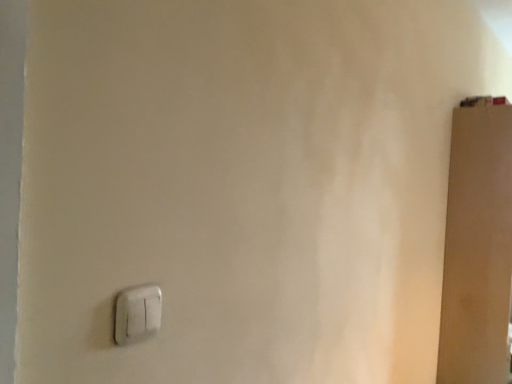
Question: Is white plastic light switch at lower left shorter than brown matte door at right?

Choices:
 (A) yes
 (B) no

Answer: (A)

Question: Considering the relative sizes of white plastic light switch at lower left and brown matte door at right in the image provided, is white plastic light switch at lower left wider than brown matte door at right?

Choices:
 (A) yes
 (B) no

Answer: (B)

Question: Considering the relative sizes of white plastic light switch at lower left and brown matte door at right in the image provided, is white plastic light switch at lower left smaller than brown matte door at right?

Choices:
 (A) yes
 (B) no

Answer: (A)

Question: Can you confirm if white plastic light switch at lower left is thinner than brown matte door at right?

Choices:
 (A) no
 (B) yes

Answer: (B)

Question: From the image's perspective, would you say white plastic light switch at lower left is shown under brown matte door at right?

Choices:
 (A) yes
 (B) no

Answer: (B)

Question: Is white plastic light switch at lower left facing away from brown matte door at right?

Choices:
 (A) no
 (B) yes

Answer: (A)

Question: Is brown matte door at right aimed at white plastic light switch at lower left?

Choices:
 (A) no
 (B) yes

Answer: (A)

Question: From the image's perspective, does brown matte door at right appear higher than white plastic light switch at lower left?

Choices:
 (A) no
 (B) yes

Answer: (A)

Question: Does brown matte door at right come in front of white plastic light switch at lower left?

Choices:
 (A) yes
 (B) no

Answer: (B)

Question: Considering the relative sizes of brown matte door at right and white plastic light switch at lower left in the image provided, is brown matte door at right shorter than white plastic light switch at lower left?

Choices:
 (A) no
 (B) yes

Answer: (A)

Question: Does brown matte door at right have a smaller size compared to white plastic light switch at lower left?

Choices:
 (A) yes
 (B) no

Answer: (B)

Question: Is brown matte door at right bigger than white plastic light switch at lower left?

Choices:
 (A) yes
 (B) no

Answer: (A)

Question: From a real-world perspective, is white plastic light switch at lower left above or below brown matte door at right?

Choices:
 (A) below
 (B) above

Answer: (B)